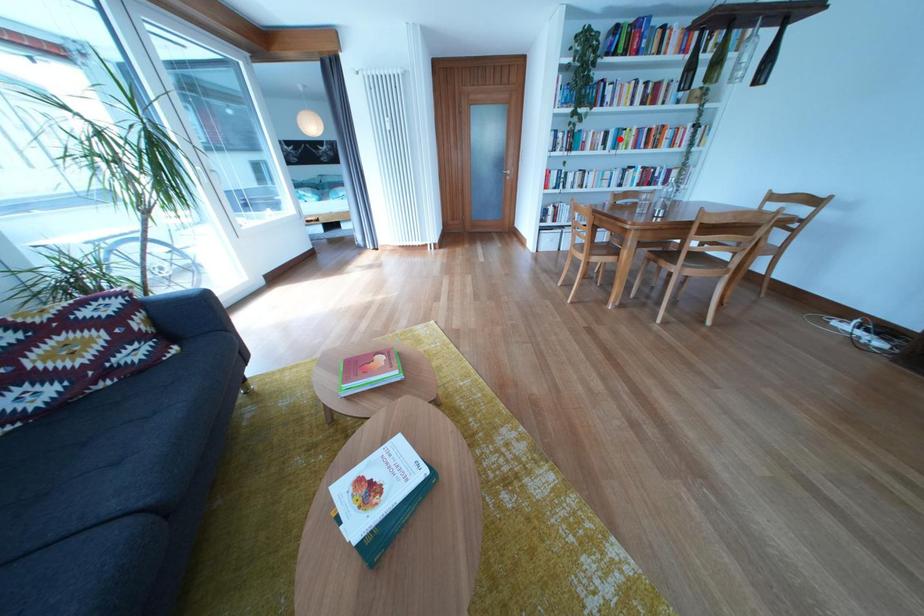
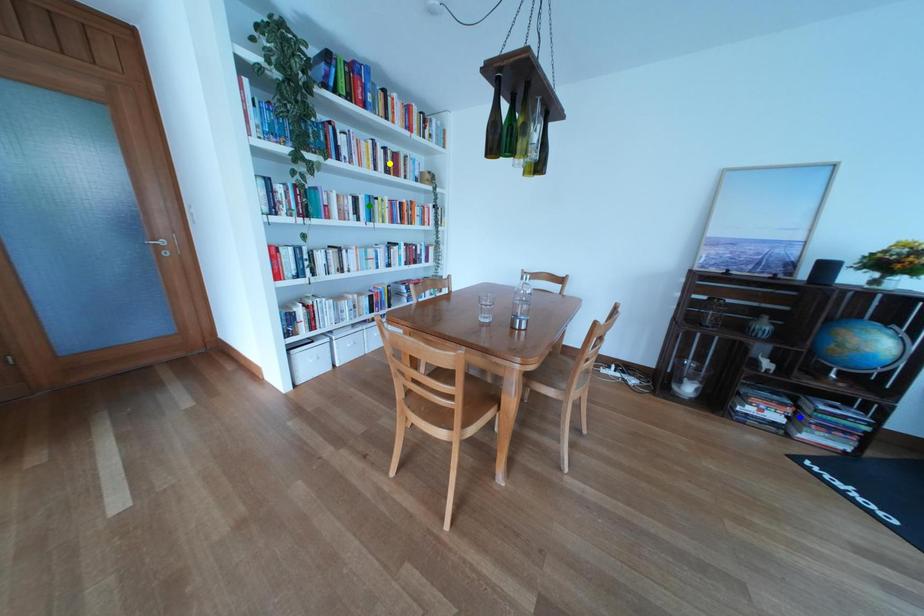
Question: I am providing you with two images of the same scene from different viewpoints. A red point is marked on the first image. You are given multiple points on the second image. Can you choose the point in image 2 that corresponds to the point in image 1?

Choices:
 (A) green point
 (B) blue point
 (C) yellow point

Answer: (A)